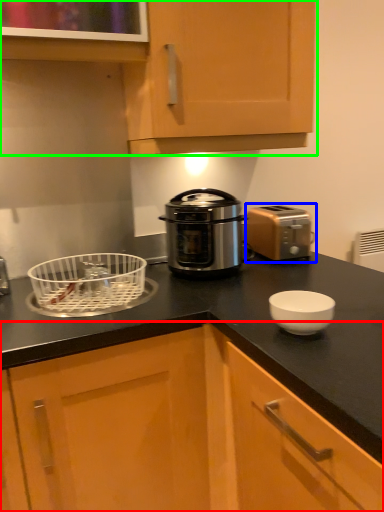
Question: Which object is the closest to the cabinetry (highlighted by a red box)? Choose among these: toaster (highlighted by a blue box) or cabinetry (highlighted by a green box).

Choices:
 (A) toaster
 (B) cabinetry

Answer: (A)